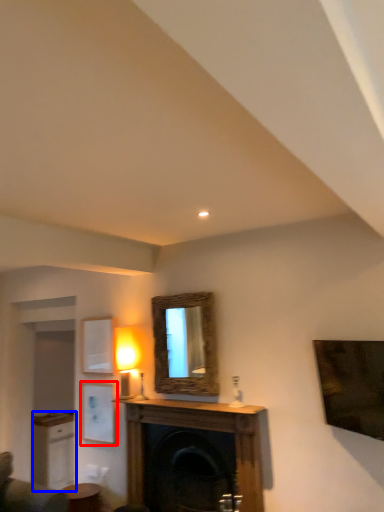
Question: Which of the following is the closest to the observer, picture frame (highlighted by a red box) or cabinetry (highlighted by a blue box)?

Choices:
 (A) picture frame
 (B) cabinetry

Answer: (A)